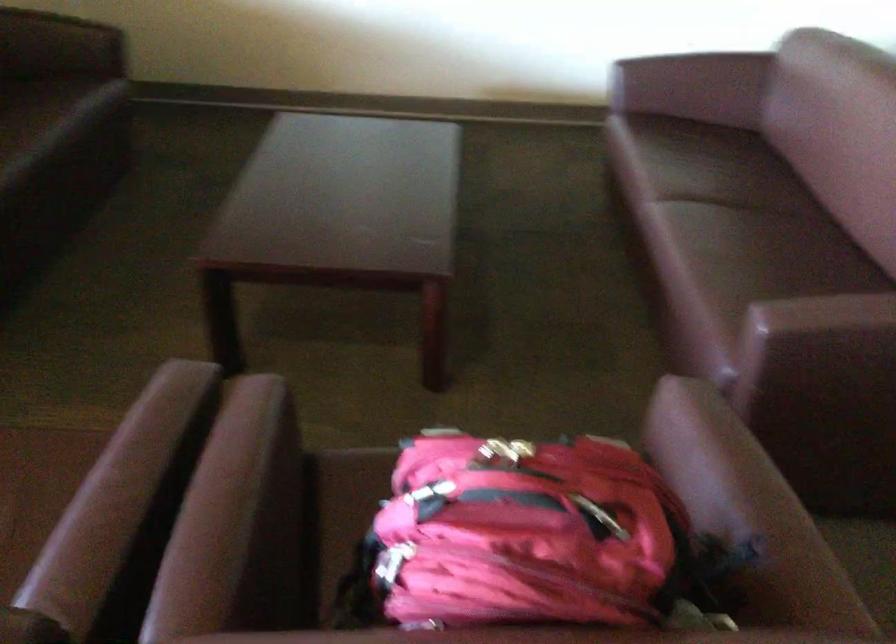
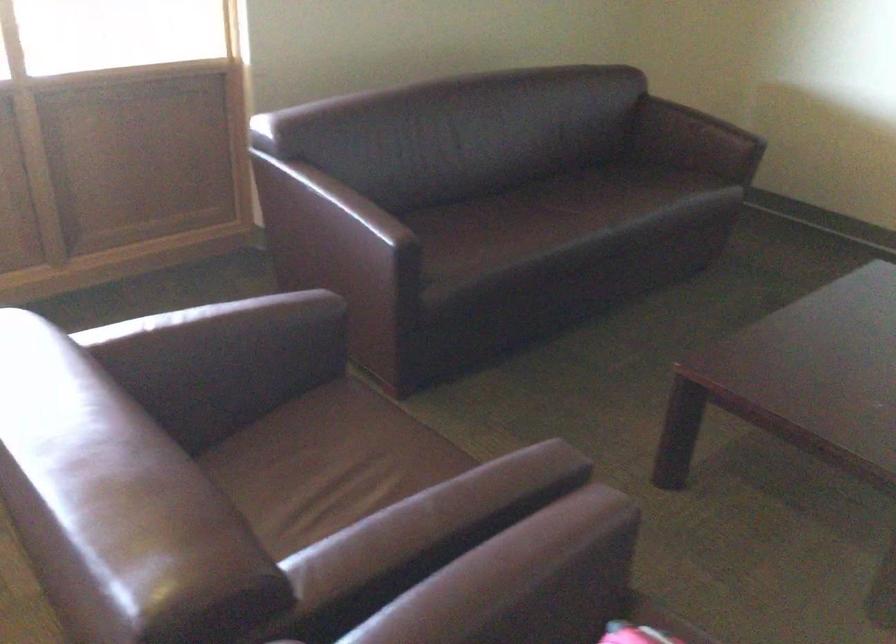
Question: The camera is either moving clockwise (left) or counter-clockwise (right) around the object. The first image is from the beginning of the video and the second image is from the end. Is the camera moving left or right when shooting the video?

Choices:
 (A) Left
 (B) Right

Answer: (B)